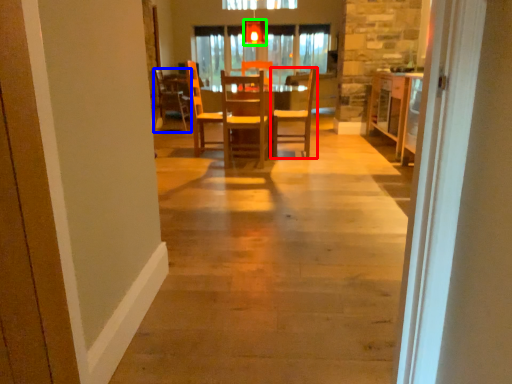
Question: Which object is positioned farthest from chair (highlighted by a red box)? Select from chair (highlighted by a blue box) and light fixture (highlighted by a green box).

Choices:
 (A) chair
 (B) light fixture

Answer: (A)